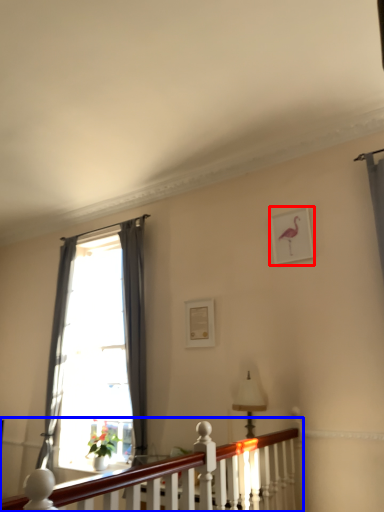
Question: Among these objects, which one is farthest to the camera, picture frame (highlighted by a red box) or balustrade (highlighted by a blue box)?

Choices:
 (A) picture frame
 (B) balustrade

Answer: (A)